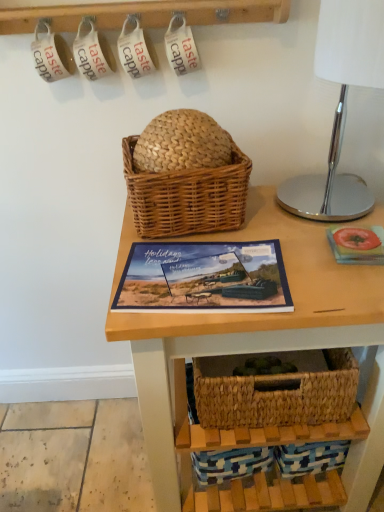
Identify the location of vacant space to the right of matte blue book at center. The height and width of the screenshot is (512, 384). (312, 263).